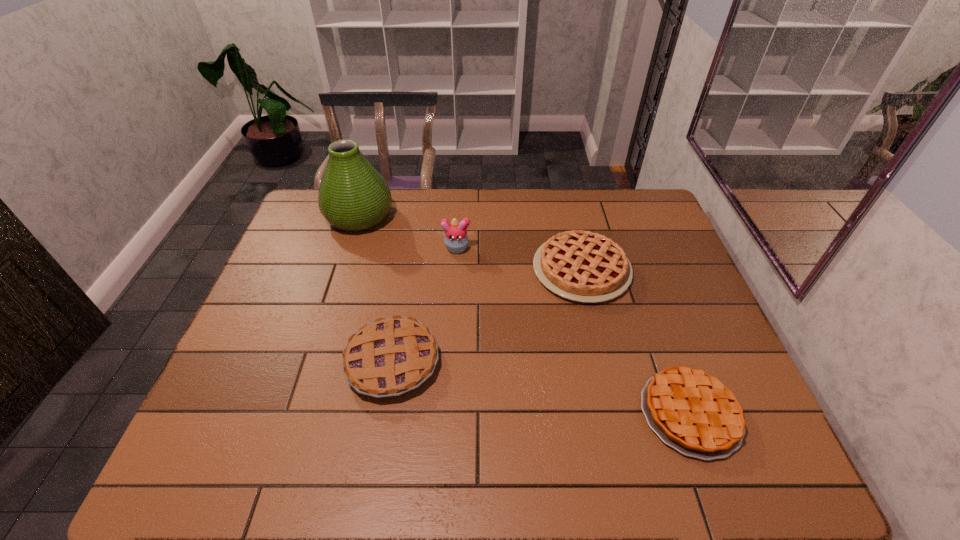
The height and width of the screenshot is (540, 960). I want to click on vase, so click(353, 196).

Where is `the fourth shortest object`? the fourth shortest object is located at coordinates (456, 239).

Identify the location of the farthest pie. Image resolution: width=960 pixels, height=540 pixels. (583, 266).

The height and width of the screenshot is (540, 960). Find the location of `the leftmost pie`. the leftmost pie is located at coordinates (391, 356).

Locate an element on the screen. Image resolution: width=960 pixels, height=540 pixels. the shortest object is located at coordinates (691, 411).

You are a GUI agent. You are given a task and a screenshot of the screen. Output one action in this format:
    pyautogui.click(x=<x>, y=<y>)
    Task: Click on the vacant space located 0.310m on the right of the tallest object
    Image resolution: width=960 pixels, height=540 pixels.
    Given the screenshot: What is the action you would take?
    pyautogui.click(x=485, y=217)

Identify the location of blank space located on the face of the second tallest object. (450, 349).

Find the location of `vacant region located 0.160m on the front of the farthest pie`. vacant region located 0.160m on the front of the farthest pie is located at coordinates (601, 354).

Image resolution: width=960 pixels, height=540 pixels. Find the location of `free space located 0.340m on the back of the leftmost pie`. free space located 0.340m on the back of the leftmost pie is located at coordinates (412, 242).

Image resolution: width=960 pixels, height=540 pixels. I want to click on blank space located on the back of the shortest object, so [636, 266].